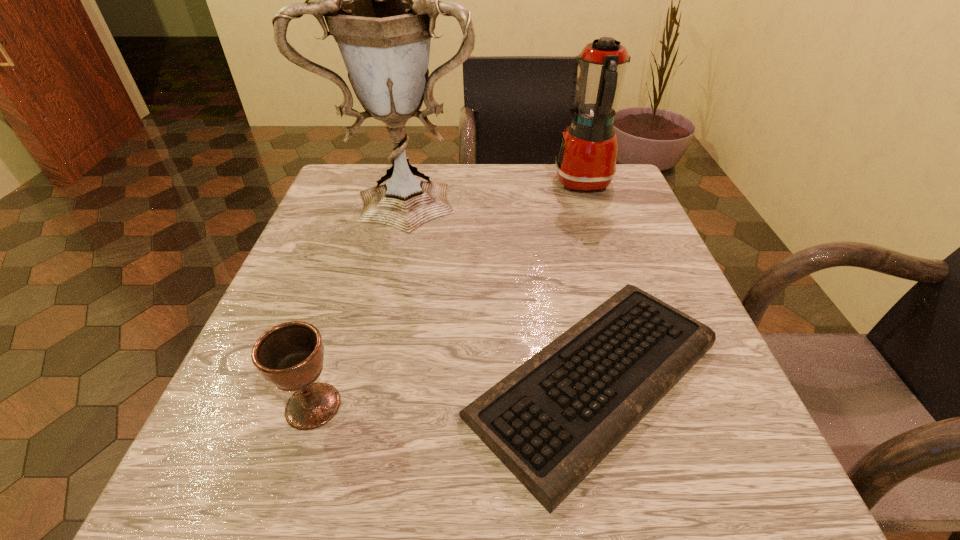
What are the coordinates of `trophy cup located in the far edge section of the desktop` in the screenshot? It's located at (380, 0).

Locate an element on the screen. The width and height of the screenshot is (960, 540). food processor that is at the far edge is located at coordinates (586, 160).

This screenshot has height=540, width=960. I want to click on object at the near edge, so click(551, 421).

Find the location of a particular element. trophy cup that is positioned at the left edge is located at coordinates (380, 0).

Locate an element on the screen. This screenshot has height=540, width=960. chalice situated at the left edge is located at coordinates click(290, 356).

Image resolution: width=960 pixels, height=540 pixels. In order to click on food processor situated at the right edge in this screenshot , I will do `click(586, 160)`.

Locate an element on the screen. computer keyboard at the right edge is located at coordinates (551, 421).

You are a GUI agent. You are given a task and a screenshot of the screen. Output one action in this format:
    pyautogui.click(x=<x>, y=<y>)
    Task: Click on the object that is at the far left corner
    
    Given the screenshot: What is the action you would take?
    pyautogui.click(x=380, y=0)

At what (x,y) coordinates should I click in order to perform the action: click on object present at the far right corner. Please return your answer as a coordinate pair (x, y). The image size is (960, 540). Looking at the image, I should click on (586, 160).

The width and height of the screenshot is (960, 540). I want to click on object at the near right corner, so click(551, 421).